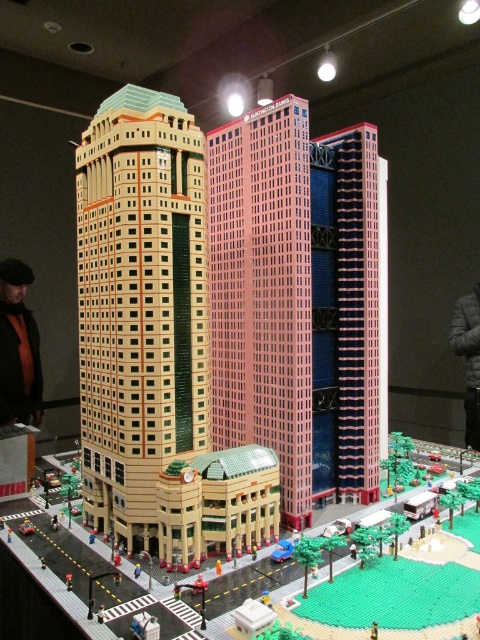
Which of these two, orange scarf at left or gray fabric jacket at upper right, stands shorter?

With less height is orange scarf at left.

Is orange scarf at left bigger than gray fabric jacket at upper right?

Incorrect, orange scarf at left is not larger than gray fabric jacket at upper right.

Find the location of a particular element. This screenshot has width=480, height=640. orange scarf at left is located at coordinates (17, 348).

Is pink plastic building at center in front of gray fabric jacket at upper right?

Yes, it is.

Which is in front, point (263, 164) or point (472, 307)?

Point (263, 164) is in front.

Which is behind, point (292, 376) or point (453, 314)?

The point (453, 314) is more distant.

Image resolution: width=480 pixels, height=640 pixels. What are the coordinates of `pink plastic building at center` in the screenshot? It's located at (263, 291).

Between beige brick building at center and pink plastic building at center, which one appears on the left side from the viewer's perspective?

beige brick building at center is more to the left.

Between beige brick building at center and pink plastic building at center, which one is positioned higher?

pink plastic building at center is higher up.

Find the location of a particular element. This screenshot has width=480, height=640. beige brick building at center is located at coordinates (140, 305).